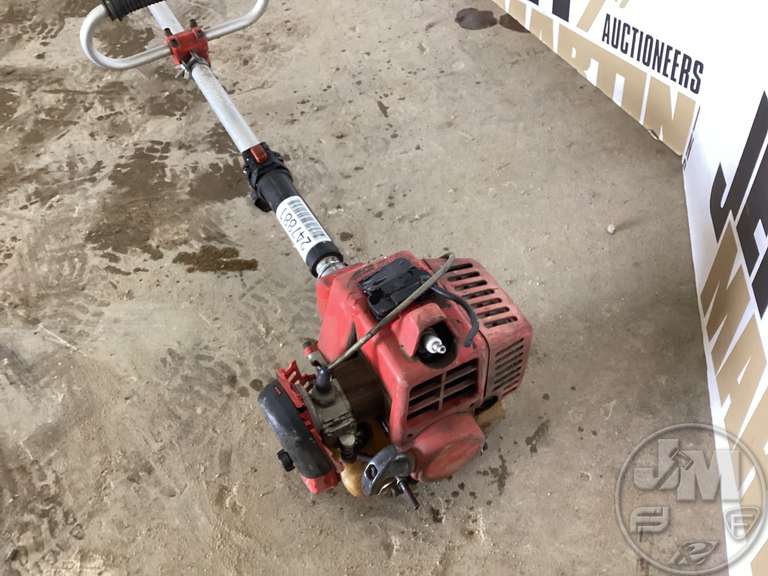
The width and height of the screenshot is (768, 576). Find the location of `dust on floor`. dust on floor is located at coordinates (146, 314), (606, 314), (520, 155).